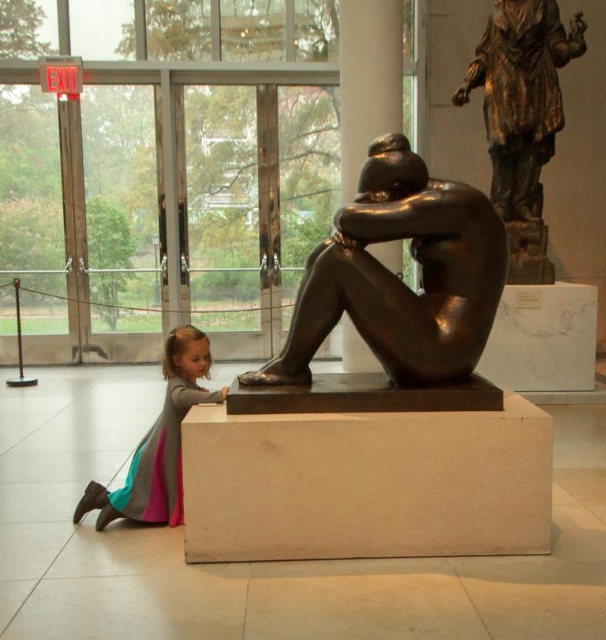
Is the position of bronze statue at upper right less distant than that of gray fabric dress at lower left?

No, it is not.

The image size is (606, 640). What are the coordinates of `bronze statue at upper right` in the screenshot? It's located at (522, 116).

Who is shorter, bronze/metallic figure at center or bronze statue at upper right?

Standing shorter between the two is bronze/metallic figure at center.

At what (x,y) coordinates should I click in order to perform the action: click on bronze/metallic figure at center. Please return your answer as a coordinate pair (x, y). Looking at the image, I should click on (399, 278).

Who is positioned more to the right, bronze/metallic figure at center or gray fabric dress at lower left?

bronze/metallic figure at center

Which is behind, point (375, 308) or point (127, 493)?

Positioned behind is point (127, 493).

Based on the photo, who is more forward, (461, 376) or (102, 484)?

Positioned in front is point (461, 376).

Image resolution: width=606 pixels, height=640 pixels. Find the location of `bronze/metallic figure at center`. bronze/metallic figure at center is located at coordinates (399, 278).